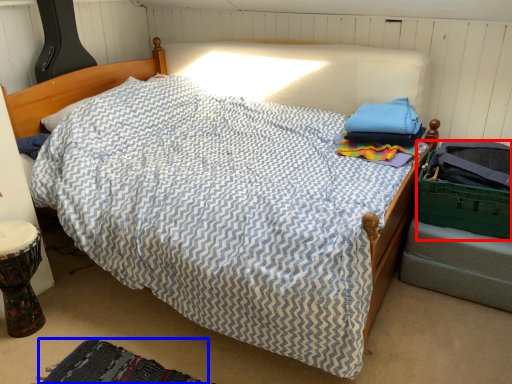
Question: Which point is closer to the camera, laundry basket (highlighted by a red box) or mat (highlighted by a blue box)?

Choices:
 (A) laundry basket
 (B) mat

Answer: (B)